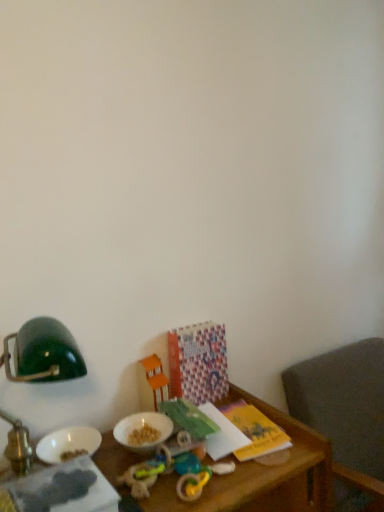
Question: Which direction should I rotate to face patterned paper calendar at lower center, acting as the 1th book starting from the back, — up or down?

Choices:
 (A) down
 (B) up

Answer: (A)

Question: Could orange plastic toy house at center, the third toy viewed from the front, be considered to be inside rubber teething ring at lower center, which is counted as the 3th toy, starting from the back?

Choices:
 (A) yes
 (B) no

Answer: (B)

Question: Does rubber teething ring at lower center, which is counted as the 3th toy, starting from the back, come behind orange plastic toy house at center, the third toy viewed from the front?

Choices:
 (A) yes
 (B) no

Answer: (B)

Question: Is rubber teething ring at lower center, the first toy when ordered from front to back, facing away from orange plastic toy house at center, which is the 1th toy from back to front?

Choices:
 (A) no
 (B) yes

Answer: (B)

Question: From a real-world perspective, is rubber teething ring at lower center, which is counted as the 3th toy, starting from the back, positioned under orange plastic toy house at center, the third toy viewed from the front, based on gravity?

Choices:
 (A) no
 (B) yes

Answer: (B)

Question: Is the position of rubber teething ring at lower center, which is counted as the 3th toy, starting from the back, less distant than that of orange plastic toy house at center, which is the 1th toy from back to front?

Choices:
 (A) yes
 (B) no

Answer: (A)

Question: From the image's perspective, would you say rubber teething ring at lower center, the first toy when ordered from front to back, is positioned over orange plastic toy house at center, which is the 1th toy from back to front?

Choices:
 (A) no
 (B) yes

Answer: (A)

Question: From the image's perspective, is patterned paper calendar at lower center, the 1th book from the right, below matte green book at lower left, which is counted as the 2th book, starting from the right?

Choices:
 (A) yes
 (B) no

Answer: (B)

Question: Does patterned paper calendar at lower center, which is the 2th book from front to back, lie behind matte green book at lower left, which is counted as the 2th book, starting from the right?

Choices:
 (A) no
 (B) yes

Answer: (B)

Question: Considering the relative positions of patterned paper calendar at lower center, which is the 2th book from front to back, and matte green book at lower left, marked as the 1th book in a left-to-right arrangement, in the image provided, is patterned paper calendar at lower center, which is the 2th book from front to back, to the left of matte green book at lower left, marked as the 1th book in a left-to-right arrangement, from the viewer's perspective?

Choices:
 (A) no
 (B) yes

Answer: (A)

Question: Is patterned paper calendar at lower center, arranged as the second book when viewed from the left, thinner than matte green book at lower left, which ranks as the second book in back-to-front order?

Choices:
 (A) yes
 (B) no

Answer: (A)

Question: Is patterned paper calendar at lower center, which is the 2th book from front to back, shorter than matte green book at lower left, the 1th book from the front?

Choices:
 (A) no
 (B) yes

Answer: (A)

Question: Is patterned paper calendar at lower center, acting as the 1th book starting from the back, positioned beyond the bounds of matte green book at lower left, which ranks as the second book in back-to-front order?

Choices:
 (A) no
 (B) yes

Answer: (B)

Question: From the image's perspective, is green matte lampshade at upper left under gray fabric chair at lower right?

Choices:
 (A) yes
 (B) no

Answer: (B)